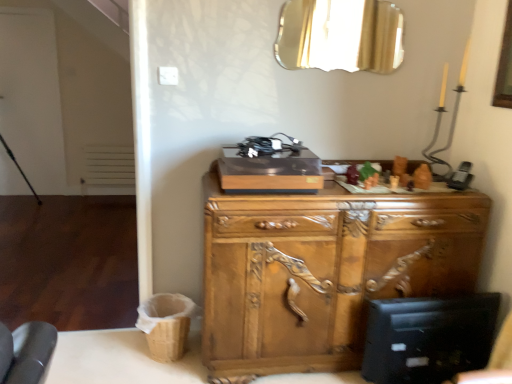
Question: From the image's perspective, relative to wooden carved cabinet at center, is clear glass mirror at upper center above or below?

Choices:
 (A) above
 (B) below

Answer: (A)

Question: Based on their sizes in the image, would you say clear glass mirror at upper center is bigger or smaller than wooden carved cabinet at center?

Choices:
 (A) small
 (B) big

Answer: (A)

Question: Which is correct: clear glass mirror at upper center is inside wooden carved cabinet at center, or outside of it?

Choices:
 (A) inside
 (B) outside

Answer: (B)

Question: From a real-world perspective, is wooden carved cabinet at center above or below clear glass mirror at upper center?

Choices:
 (A) below
 (B) above

Answer: (A)

Question: Does point (464, 215) appear closer or farther from the camera than point (324, 29)?

Choices:
 (A) farther
 (B) closer

Answer: (B)

Question: Looking at the image, does wooden carved cabinet at center seem bigger or smaller compared to clear glass mirror at upper center?

Choices:
 (A) small
 (B) big

Answer: (B)

Question: Is wooden carved cabinet at center wider or thinner than clear glass mirror at upper center?

Choices:
 (A) thin
 (B) wide

Answer: (B)